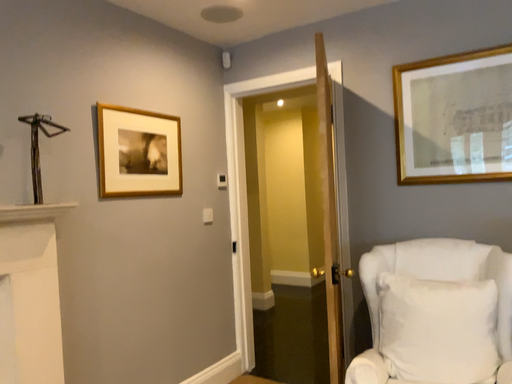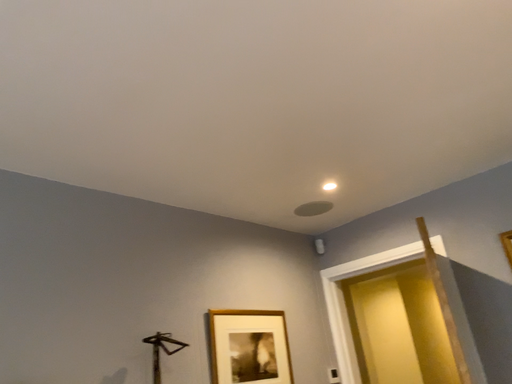
Question: Which way did the camera rotate in the video?

Choices:
 (A) rotated right
 (B) rotated left

Answer: (B)